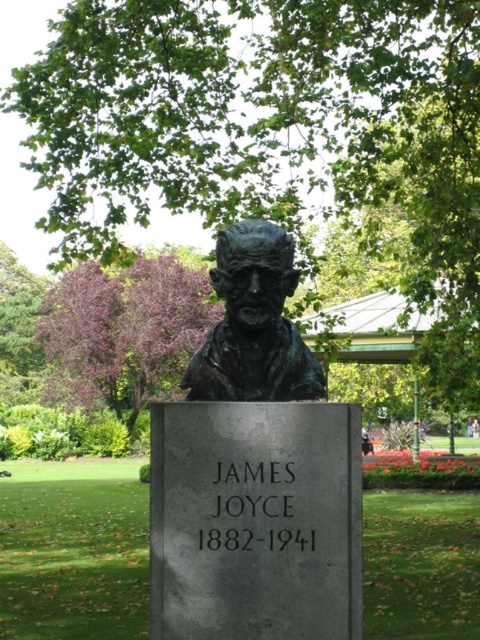
Is point (396, 58) more distant than point (223, 353)?

Yes, it is.

Does green leafy tree at upper center have a lesser height compared to bronze bust at center?

No.

Which is behind, point (324, 116) or point (274, 376)?

Positioned behind is point (324, 116).

Image resolution: width=480 pixels, height=640 pixels. In order to click on green leafy tree at upper center in this screenshot , I will do `click(271, 131)`.

Does purple leafy tree at upper left have a lesser width compared to bronze bust at center?

Indeed, purple leafy tree at upper left has a lesser width compared to bronze bust at center.

Looking at this image, does purple leafy tree at upper left come behind bronze bust at center?

Yes.

Is point (159, 344) closer to viewer compared to point (247, 228)?

No, (159, 344) is behind (247, 228).

Identify the location of purple leafy tree at upper left. The height and width of the screenshot is (640, 480). (123, 332).

Does green leafy tree at upper center appear on the left side of purple leafy tree at upper left?

Incorrect, green leafy tree at upper center is not on the left side of purple leafy tree at upper left.

Does point (431, 241) come in front of point (48, 305)?

Yes.

Where is `green leafy tree at upper center`? green leafy tree at upper center is located at coordinates [x=271, y=131].

Where is `green leafy tree at upper center`? green leafy tree at upper center is located at coordinates (271, 131).